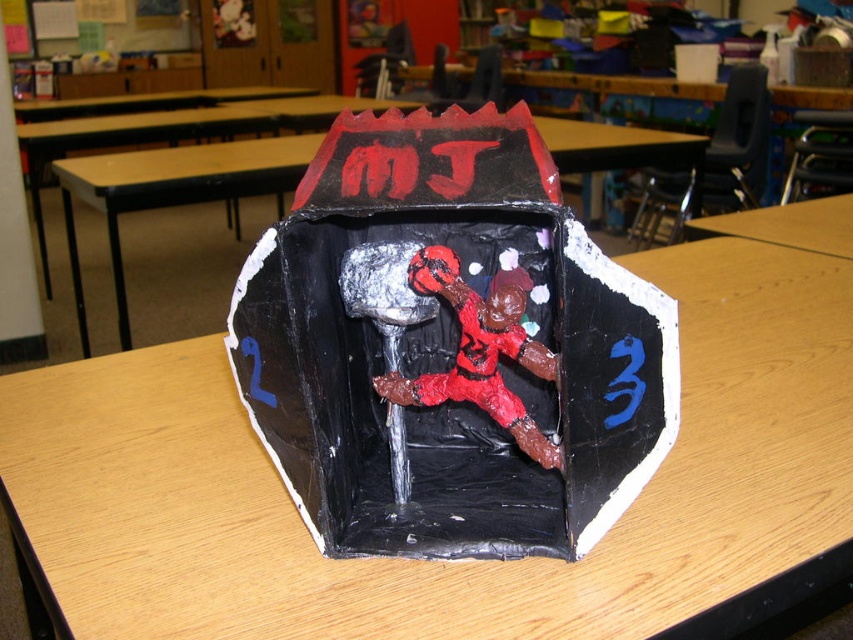
Question: Is wooden table at center wider than matte black figurine at center?

Choices:
 (A) no
 (B) yes

Answer: (B)

Question: Does wooden table at center have a smaller size compared to light brown wood table at center?

Choices:
 (A) no
 (B) yes

Answer: (A)

Question: Which object appears closest to the camera in this image?

Choices:
 (A) light brown wood table at center
 (B) matte black figurine at center

Answer: (B)

Question: Is matte black figurine at center bigger than light brown wood table at center?

Choices:
 (A) yes
 (B) no

Answer: (A)

Question: Which is nearer to the light brown wood table at center?

Choices:
 (A) matte black figurine at center
 (B) wooden table at center
 (C) black cardboard box at center

Answer: (B)

Question: Which point is farther to the camera?

Choices:
 (A) black cardboard box at center
 (B) light brown wood table at center
 (C) matte black figurine at center

Answer: (A)